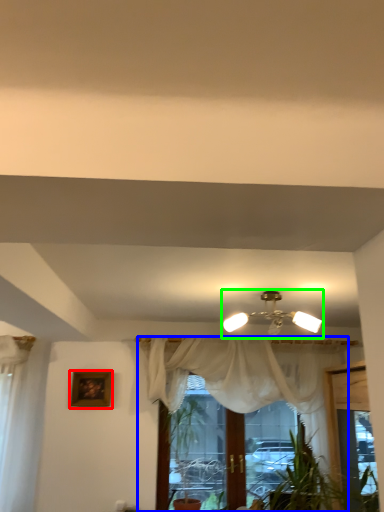
Question: Considering the real-world distances, which object is closest to picture frame (highlighted by a red box)? curtain (highlighted by a blue box) or lamp (highlighted by a green box).

Choices:
 (A) curtain
 (B) lamp

Answer: (A)